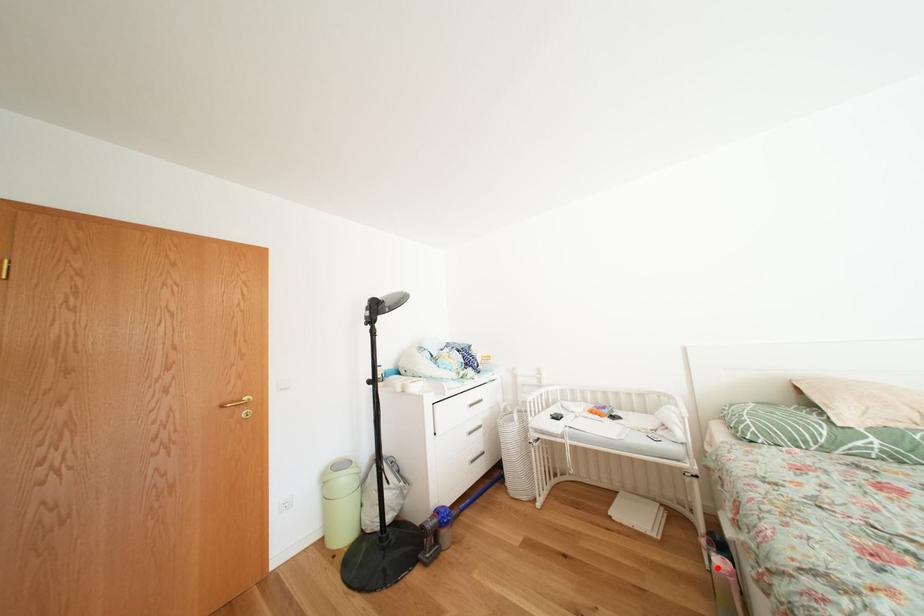
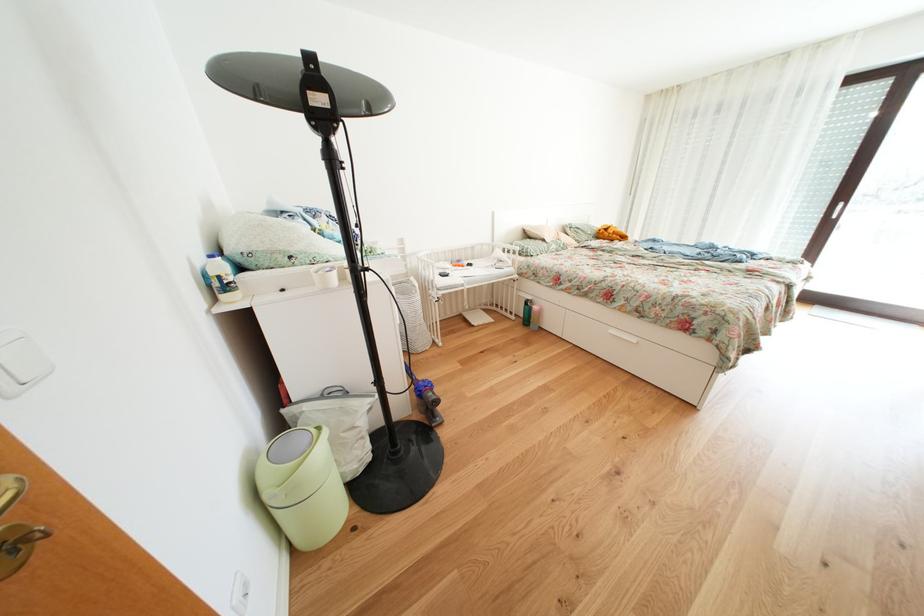
Question: I am providing you with two images of the same scene from different viewpoints. Image1 has a red point marked. In image2, the corresponding 3D location appears at what relative position? Reply with the corresponding letter.

Choices:
 (A) Closer
 (B) Farther

Answer: (A)